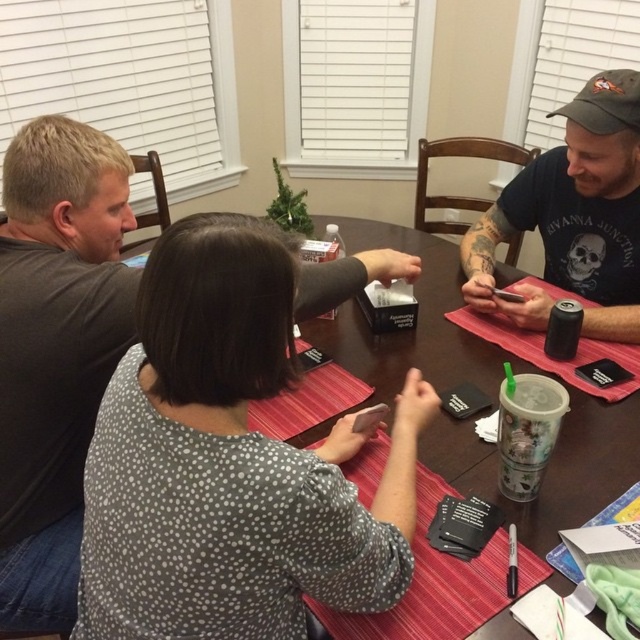
Which is below, white dotted shirt at center or dark gray cap at upper right?

white dotted shirt at center is below.

Is the position of white dotted shirt at center more distant than that of dark gray cap at upper right?

No, it is not.

Is point (333, 477) positioned behind point (570, 189)?

No, (333, 477) is closer to viewer.

Identify the location of white dotted shirt at center. (228, 461).